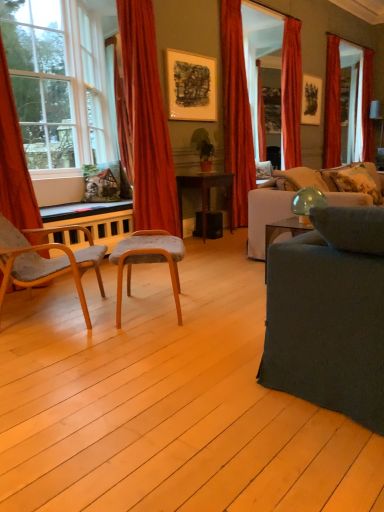
Question: From a real-world perspective, is dark gray fabric couch at right, the 1th studio couch when ordered from front to back, physically located above or below gray fabric stool at center, the 2th chair positioned from the left?

Choices:
 (A) above
 (B) below

Answer: (A)

Question: Does point (379, 392) appear closer or farther from the camera than point (119, 289)?

Choices:
 (A) closer
 (B) farther

Answer: (A)

Question: Estimate the real-world distances between objects in this image. Which object is closer to the wooden desk at center?

Choices:
 (A) clear glass window at left
 (B) beige fabric pillow at right, acting as the 2th pillow starting from the right
 (C) translucent glass lampshade at upper right
 (D) wooden chair at left, positioned as the second chair in right-to-left order
 (E) velvet red curtain at center, the third curtain viewed from the left

Answer: (E)

Question: Estimate the real-world distances between objects in this image. Which object is farther from the orange velvet curtain at left, which appears as the first curtain when viewed from the left?

Choices:
 (A) matte black picture frame at upper right, arranged as the first picture frame when viewed from the back
 (B) dark gray fabric couch at right, the 1th studio couch when ordered from front to back
 (C) wooden desk at center
 (D) clear glass window at left
 (E) matte black picture frame at upper center, the 1th picture frame viewed from the front

Answer: (A)